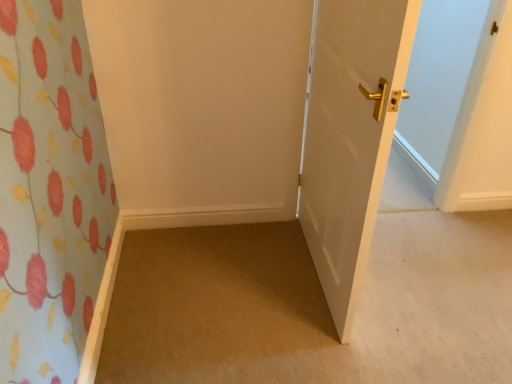
Question: Considering the positions of carpet at lower left and white glossy door at right in the image, is carpet at lower left taller or shorter than white glossy door at right?

Choices:
 (A) short
 (B) tall

Answer: (A)

Question: In the image, is carpet at lower left on the left side or the right side of white glossy door at right?

Choices:
 (A) right
 (B) left

Answer: (A)

Question: Looking at the image, does carpet at lower left seem bigger or smaller compared to white glossy door at right?

Choices:
 (A) big
 (B) small

Answer: (B)

Question: Does point (396, 11) appear closer or farther from the camera than point (160, 273)?

Choices:
 (A) closer
 (B) farther

Answer: (A)

Question: From the image's perspective, is white glossy door at right positioned above or below carpet at lower left?

Choices:
 (A) above
 (B) below

Answer: (A)

Question: Based on their sizes in the image, would you say white glossy door at right is bigger or smaller than carpet at lower left?

Choices:
 (A) small
 (B) big

Answer: (B)

Question: Is white glossy door at right to the left or to the right of carpet at lower left in the image?

Choices:
 (A) left
 (B) right

Answer: (A)